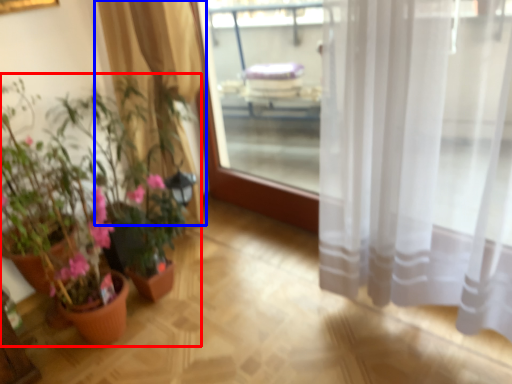
Question: Which object is closer to the camera taking this photo, houseplant (highlighted by a red box) or curtain (highlighted by a blue box)?

Choices:
 (A) houseplant
 (B) curtain

Answer: (A)